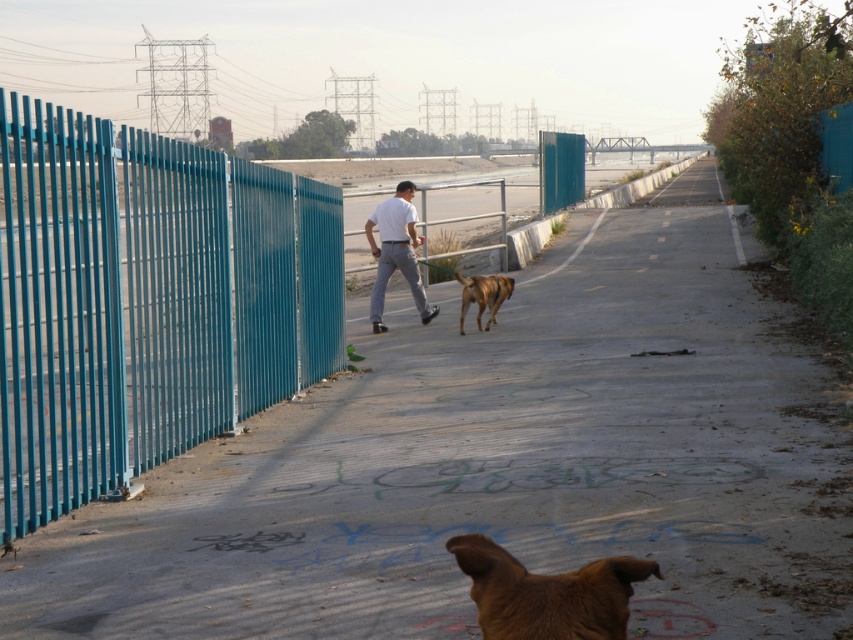
You are a photographer trying to capture a photo of the brown fur dog at center and the white matte shirt at center. Which object should you zoom in on to focus on the thinner one?

The white matte shirt at center is thinner than the brown fur dog at center, so you should zoom in on the white matte shirt at center to focus on the thinner one.

You are standing on the pathway and want to take a photo of the metallic blue fence at left and the white matte shirt at center. Since you want both objects to appear clearly in the frame, which object should you focus on first to ensure clarity?

You should focus on the metallic blue fence at left first because it has a lesser width compared to the white matte shirt at center, so it might be farther away and require more precise focusing for clarity.

You are a photographer standing at the end of the pathway. You want to take a photo of the white matte shirt at center and the brown fur dog at center. Which one will appear taller in the photo?

The brown fur dog at center will appear taller in the photo because the white matte shirt at center is shorter than the brown fur dog at center.